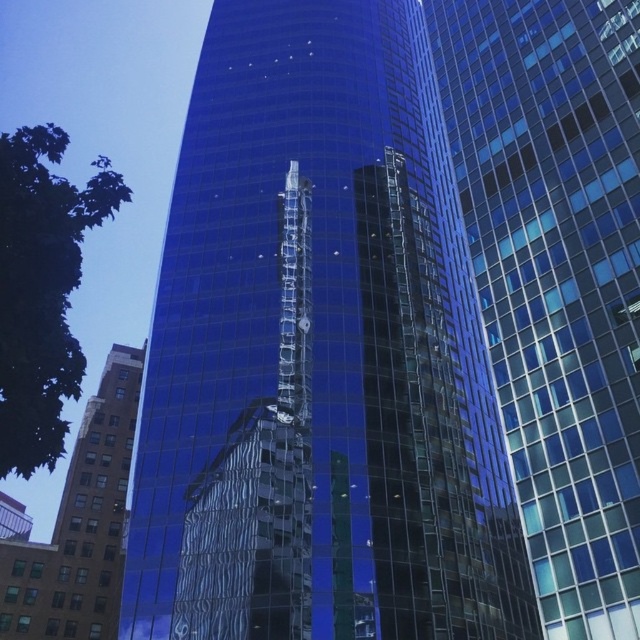
Which is above, glossy glass building at center or transparent glass building at center?

glossy glass building at center is above.

In order to click on glossy glass building at center in this screenshot , I will do `click(317, 355)`.

Find the location of `glossy glass building at center`. glossy glass building at center is located at coordinates (317, 355).

Who is taller, glossy glass building at center or brown brick building at lower left?

Standing taller between the two is glossy glass building at center.

Based on the photo, between glossy glass building at center and brown brick building at lower left, which one appears on the left side from the viewer's perspective?

From the viewer's perspective, brown brick building at lower left appears more on the left side.

Who is more forward, (193, 218) or (109, 593)?

Point (193, 218) is more forward.

Locate an element on the screen. glossy glass building at center is located at coordinates (317, 355).

Does point (611, 220) come farther from viewer compared to point (109, 522)?

No.

Is transparent glass building at center thinner than brown brick building at lower left?

Correct, transparent glass building at center's width is less than brown brick building at lower left's.

Between point (611, 621) and point (109, 557), which one is positioned in front?

Point (611, 621)

Locate an element on the screen. transparent glass building at center is located at coordinates (556, 276).